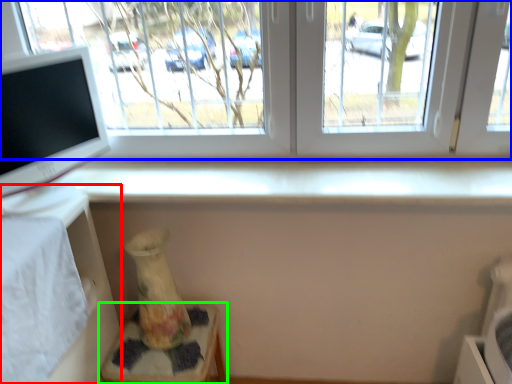
Question: Estimate the real-world distances between objects in this image. Which object is closer to table (highlighted by a red box), window (highlighted by a blue box) or furniture (highlighted by a green box)?

Choices:
 (A) window
 (B) furniture

Answer: (B)